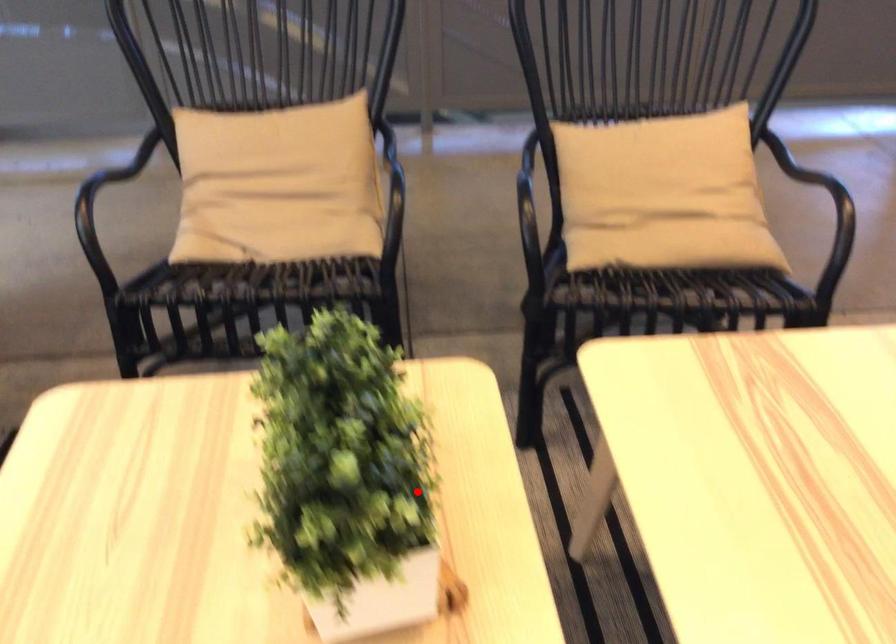
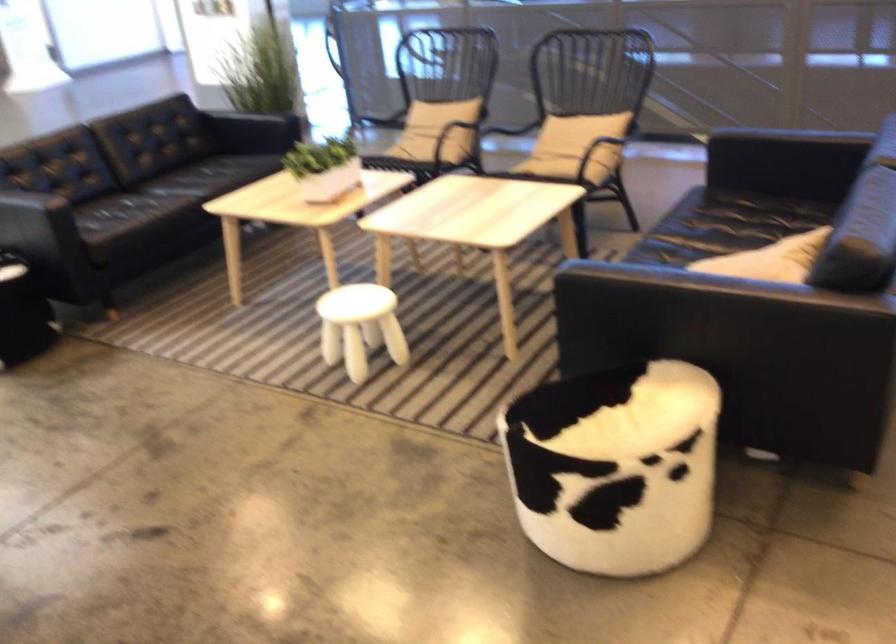
The point at the highlighted location is marked in the first image. Where is the corresponding point in the second image?

(323, 167)